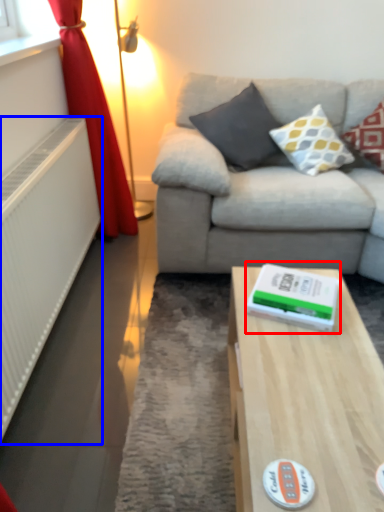
Question: Which object is closer to the camera taking this photo, paperback book (highlighted by a red box) or radiator (highlighted by a blue box)?

Choices:
 (A) paperback book
 (B) radiator

Answer: (B)